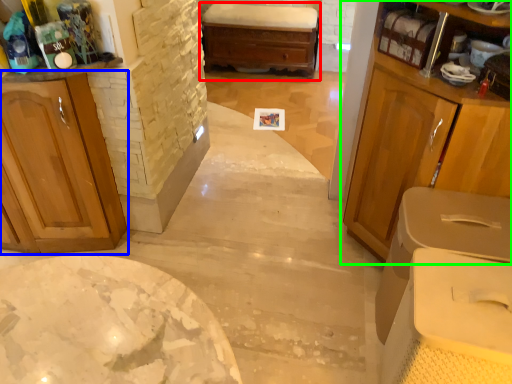
Question: Which is farther away from chest of drawers (highlighted by a red box)? cabinetry (highlighted by a blue box) or cabinetry (highlighted by a green box)?

Choices:
 (A) cabinetry
 (B) cabinetry

Answer: (A)